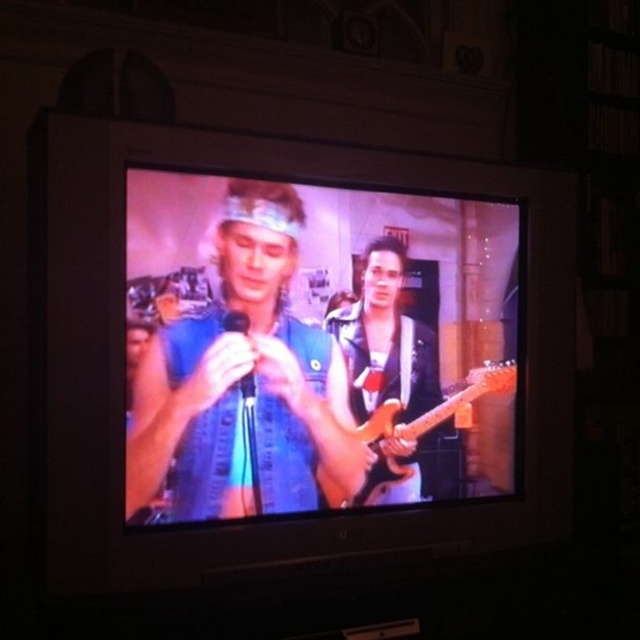
Question: Based on their relative distances, which object is farther from the glossy wood guitar at center?

Choices:
 (A) blue denim vest at center
 (B) shiny black guitar at center

Answer: (A)

Question: Is blue denim vest at center bigger than shiny black guitar at center?

Choices:
 (A) no
 (B) yes

Answer: (B)

Question: Estimate the real-world distances between objects in this image. Which object is closer to the shiny black guitar at center?

Choices:
 (A) blue denim vest at center
 (B) glossy wood guitar at center

Answer: (B)

Question: Which point is closer to the camera?

Choices:
 (A) (435, 362)
 (B) (460, 422)

Answer: (A)

Question: Can you confirm if shiny black guitar at center is thinner than glossy wood guitar at center?

Choices:
 (A) no
 (B) yes

Answer: (B)

Question: Is blue denim vest at center further to the viewer compared to shiny black guitar at center?

Choices:
 (A) yes
 (B) no

Answer: (B)